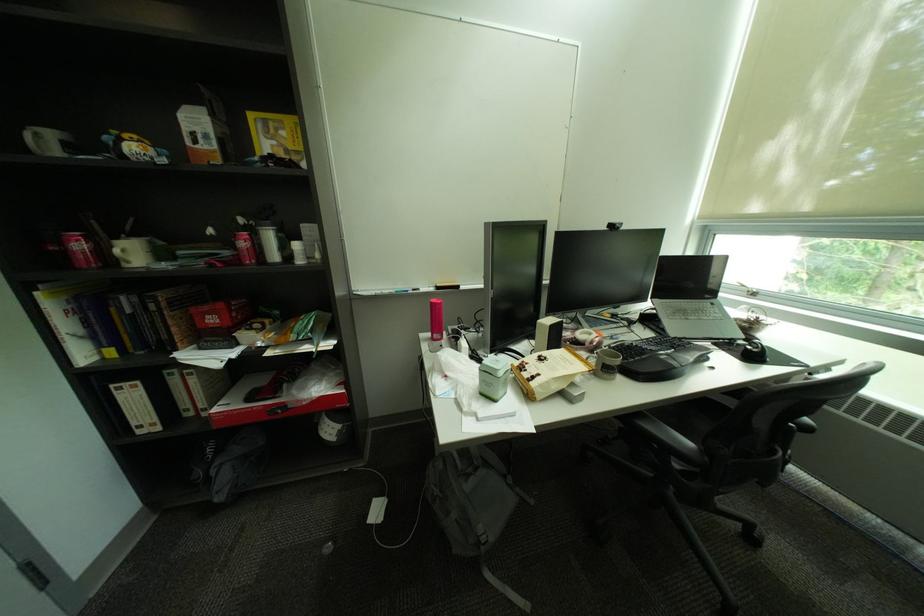
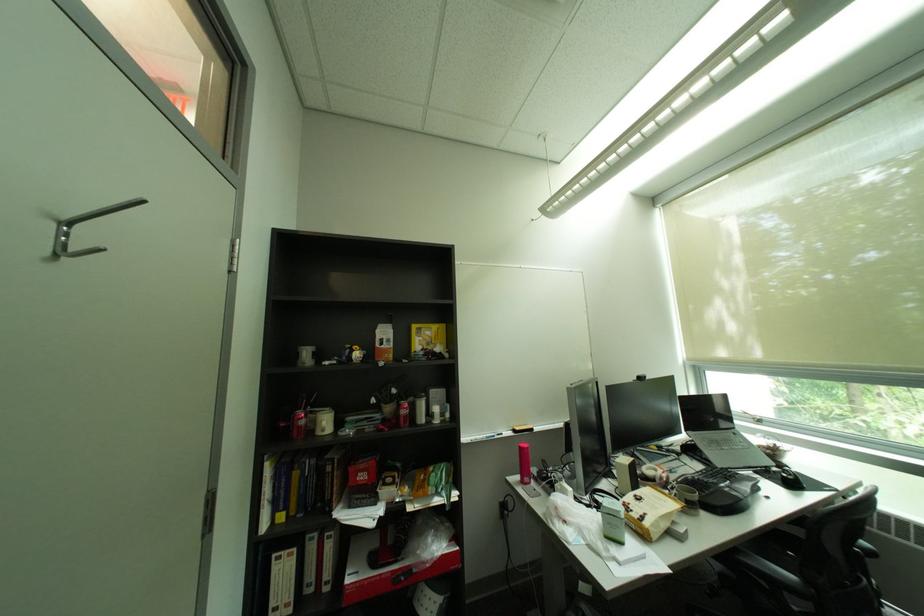
Find the pixel in the second image that matches (x=743, y=341) in the first image.

(777, 468)